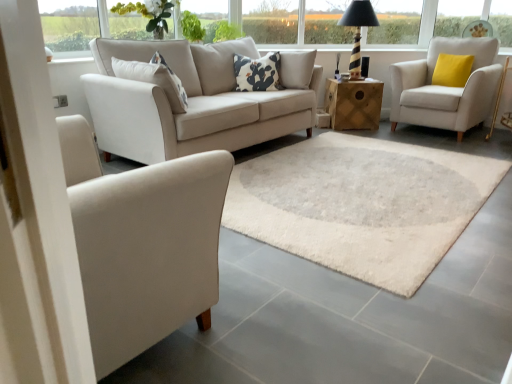
Question: Is matte white armchair at left, the second chair when ordered from back to front, placed right next to white cotton pillow at center, marked as the 1th pillow in a front-to-back arrangement?

Choices:
 (A) no
 (B) yes

Answer: (A)

Question: Is matte white armchair at left, marked as the first chair in a left-to-right arrangement, further to camera compared to white cotton pillow at center, which appears as the second pillow when viewed from the right?

Choices:
 (A) no
 (B) yes

Answer: (A)

Question: From the image's perspective, does matte white armchair at left, which is counted as the second chair, starting from the top, appear higher than white cotton pillow at center, the second pillow when ordered from back to front?

Choices:
 (A) yes
 (B) no

Answer: (B)

Question: From a real-world perspective, is matte white armchair at left, marked as the first chair in a left-to-right arrangement, on white cotton pillow at center, the second pillow when ordered from back to front?

Choices:
 (A) no
 (B) yes

Answer: (A)

Question: Is matte white armchair at left, marked as the first chair in a left-to-right arrangement, thinner than white cotton pillow at center, the second pillow when ordered from back to front?

Choices:
 (A) no
 (B) yes

Answer: (A)

Question: Visually, is transparent glass window at upper left, positioned as the 2th window in right-to-left order, positioned to the left or to the right of matte white armchair at left, placed as the 2th chair when sorted from right to left?

Choices:
 (A) right
 (B) left

Answer: (B)

Question: From a real-world perspective, relative to matte white armchair at left, the 1th chair when ordered from bottom to top, is transparent glass window at upper left, the second window viewed from the back, vertically above or below?

Choices:
 (A) below
 (B) above

Answer: (B)

Question: Is point (97, 21) closer or farther from the camera than point (150, 342)?

Choices:
 (A) farther
 (B) closer

Answer: (A)

Question: From the image's perspective, is transparent glass window at upper left, the 1th window in the front-to-back sequence, located above or below matte white armchair at left, placed as the 2th chair when sorted from right to left?

Choices:
 (A) above
 (B) below

Answer: (A)

Question: From their relative heights in the image, would you say matte white armchair at left, the 1th chair when ordered from bottom to top, is taller or shorter than green leafy plant at upper center?

Choices:
 (A) short
 (B) tall

Answer: (B)

Question: In terms of size, does matte white armchair at left, the 1th chair from the front, appear bigger or smaller than green leafy plant at upper center?

Choices:
 (A) small
 (B) big

Answer: (B)

Question: Considering the positions of matte white armchair at left, placed as the 2th chair when sorted from right to left, and green leafy plant at upper center in the image, is matte white armchair at left, placed as the 2th chair when sorted from right to left, wider or thinner than green leafy plant at upper center?

Choices:
 (A) thin
 (B) wide

Answer: (B)

Question: From the image's perspective, relative to green leafy plant at upper center, is matte white armchair at left, the 1th chair from the front, above or below?

Choices:
 (A) above
 (B) below

Answer: (B)

Question: Is wooden cube at center spatially inside green leafy plant at upper center, or outside of it?

Choices:
 (A) outside
 (B) inside

Answer: (A)

Question: From their relative heights in the image, would you say wooden cube at center is taller or shorter than green leafy plant at upper center?

Choices:
 (A) tall
 (B) short

Answer: (A)